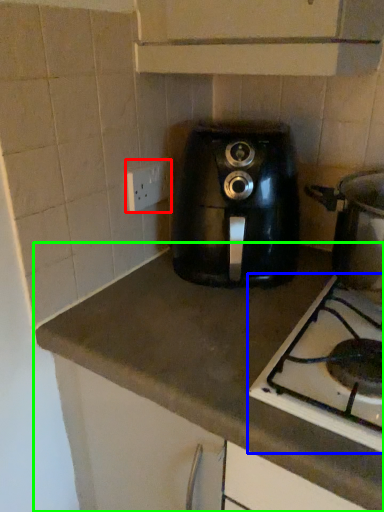
Question: Which object is positioned closest to electric outlet (highlighted by a red box)? Select from gas stove (highlighted by a blue box) and countertop (highlighted by a green box).

Choices:
 (A) gas stove
 (B) countertop

Answer: (B)